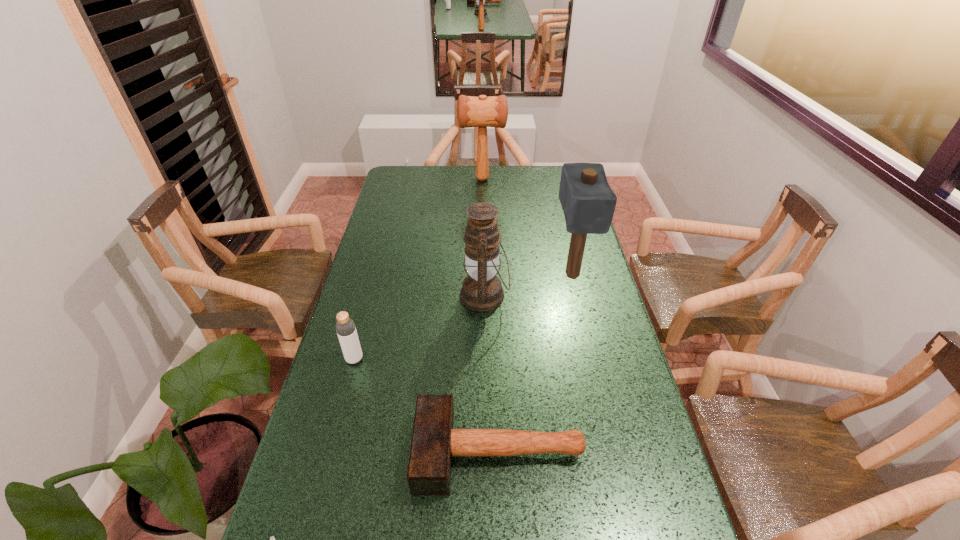
This screenshot has height=540, width=960. What are the coordinates of `the closest object relative to the shortest mallet` in the screenshot? It's located at (272, 539).

Locate an element on the screen. This screenshot has width=960, height=540. the closest mallet to the second nearest mallet is located at coordinates (434, 441).

Identify the location of mallet identified as the closest to the oil lamp. The width and height of the screenshot is (960, 540). (588, 202).

Where is `vacant region that satisfies the following two spatial constraints: 1. on the strike surface of the oil lamp; 2. on the right side of the farthest object`? vacant region that satisfies the following two spatial constraints: 1. on the strike surface of the oil lamp; 2. on the right side of the farthest object is located at coordinates (483, 295).

Where is `free spot that satisfies the following two spatial constraints: 1. on the strike surface of the farthest object; 2. on the left side of the oil lamp`? This screenshot has width=960, height=540. free spot that satisfies the following two spatial constraints: 1. on the strike surface of the farthest object; 2. on the left side of the oil lamp is located at coordinates (483, 295).

Where is `vacant point that satisfies the following two spatial constraints: 1. on the strike surface of the oil lamp; 2. on the right side of the farthest object`? vacant point that satisfies the following two spatial constraints: 1. on the strike surface of the oil lamp; 2. on the right side of the farthest object is located at coordinates (483, 295).